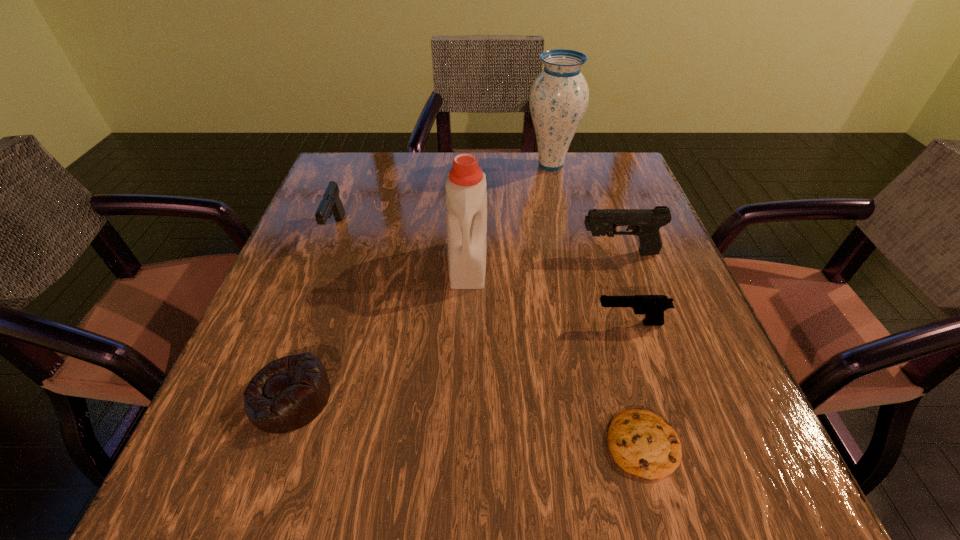
At what (x,y) coordinates should I click in order to perform the action: click on free region located on the front-facing side of the shortest pistol. Please return your answer as a coordinate pair (x, y). The height and width of the screenshot is (540, 960). Looking at the image, I should click on (491, 323).

Locate an element on the screen. The image size is (960, 540). free point located 0.120m on the back of the beanbag is located at coordinates [x=322, y=308].

Image resolution: width=960 pixels, height=540 pixels. I want to click on free region located 0.270m on the left of the cookie, so click(412, 443).

This screenshot has height=540, width=960. In order to click on object present at the far edge in this screenshot , I will do `click(558, 99)`.

Identify the location of object located in the near edge section of the desktop. (642, 443).

Locate an element on the screen. The width and height of the screenshot is (960, 540). pistol at the left edge is located at coordinates (331, 204).

At what (x,y) coordinates should I click in order to perform the action: click on beanbag positioned at the left edge. Please return your answer as a coordinate pair (x, y). Looking at the image, I should click on (288, 393).

At what (x,y) coordinates should I click in order to perform the action: click on vase located at the right edge. Please return your answer as a coordinate pair (x, y). Looking at the image, I should click on (558, 99).

Find the location of a particular element. This screenshot has height=540, width=960. cookie located in the right edge section of the desktop is located at coordinates (642, 443).

Locate an element on the screen. object positioned at the far right corner is located at coordinates (558, 99).